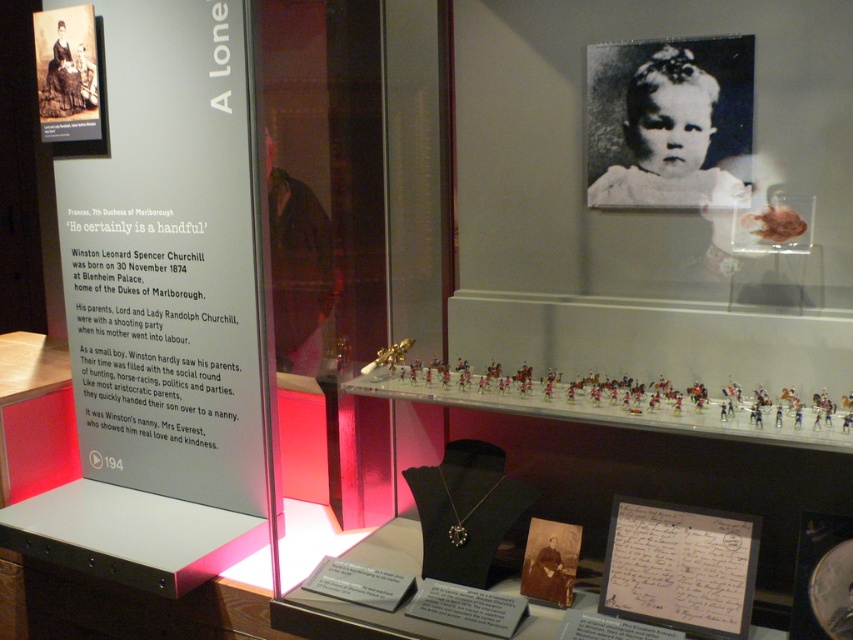
Who is more distant from viewer, (642, 93) or (97, 115)?

The point (97, 115) is more distant.

Between point (671, 60) and point (39, 58), which one is positioned in front?

Positioned in front is point (671, 60).

You are a GUI agent. You are given a task and a screenshot of the screen. Output one action in this format:
    pyautogui.click(x=<x>, y=<y>)
    Task: Click on the black paper at upper center
    
    Given the screenshot: What is the action you would take?
    pyautogui.click(x=670, y=124)

Does matte gray sign at left appear under black paper at upper center?

Yes, matte gray sign at left is below black paper at upper center.

Can you confirm if matte gray sign at left is taller than black paper at upper center?

A: Yes.

Is point (200, 36) closer to camera compared to point (694, 205)?

No, it is not.

Image resolution: width=853 pixels, height=640 pixels. In order to click on matte gray sign at left in this screenshot , I will do `click(167, 260)`.

Is matte gray sign at left above matte black portrait at upper left?

Actually, matte gray sign at left is below matte black portrait at upper left.

Does matte gray sign at left have a lesser width compared to matte black portrait at upper left?

In fact, matte gray sign at left might be wider than matte black portrait at upper left.

Does point (152, 241) come closer to viewer compared to point (80, 45)?

Yes, point (152, 241) is in front of point (80, 45).

Locate an element on the screen. The image size is (853, 640). matte gray sign at left is located at coordinates (167, 260).